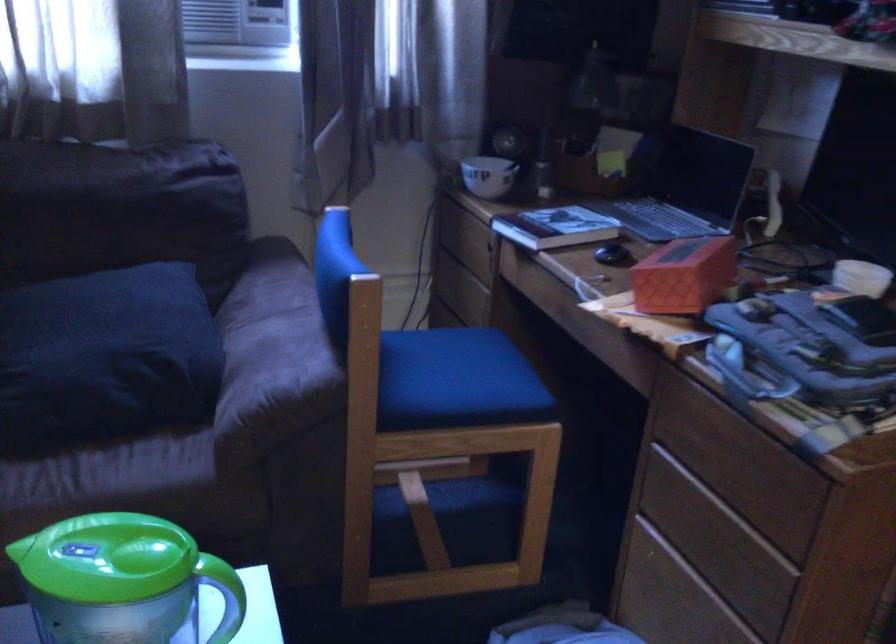
Where is `black computer mouse`? black computer mouse is located at coordinates (612, 254).